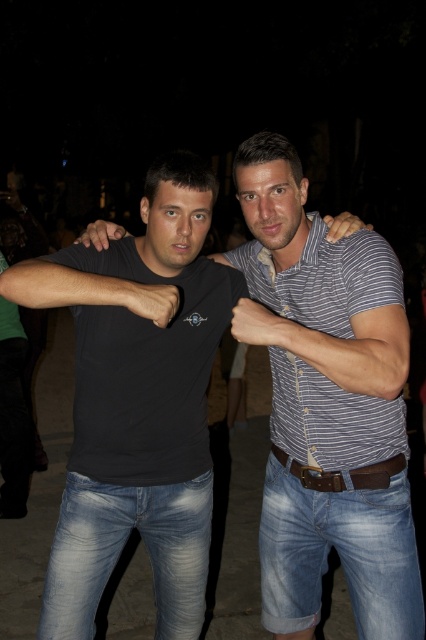
Does light blue denim jeans at lower center have a smaller size compared to black matte shirt at left?

Incorrect, light blue denim jeans at lower center is not smaller in size than black matte shirt at left.

Is point (143, 486) in front of point (121, 278)?

That is False.

Locate an element on the screen. light blue denim jeans at lower center is located at coordinates (120, 552).

Is point (282, 442) farther from camera compared to point (374, 548)?

That is True.

Between striped cotton shirt at center and blue denim jeans at center, which one is positioned lower?

blue denim jeans at center is lower down.

What do you see at coordinates (324, 278) in the screenshot? The image size is (426, 640). I see `striped cotton shirt at center` at bounding box center [324, 278].

I want to click on striped cotton shirt at center, so click(324, 278).

Looking at this image, who is more distant from viewer, (344, 250) or (20, 285)?

The point (344, 250) is more distant.

You are a GUI agent. You are given a task and a screenshot of the screen. Output one action in this format:
    pyautogui.click(x=<x>, y=<y>)
    Task: Click on the striped cotton shirt at center
    The image size is (426, 640).
    Given the screenshot: What is the action you would take?
    coord(324,278)